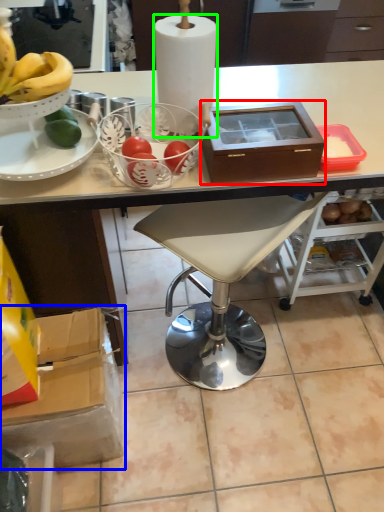
Question: Based on their relative distances, which object is farther from box (highlighted by a red box)? Choose from cardboard box (highlighted by a blue box) and paper towel (highlighted by a green box).

Choices:
 (A) cardboard box
 (B) paper towel

Answer: (A)